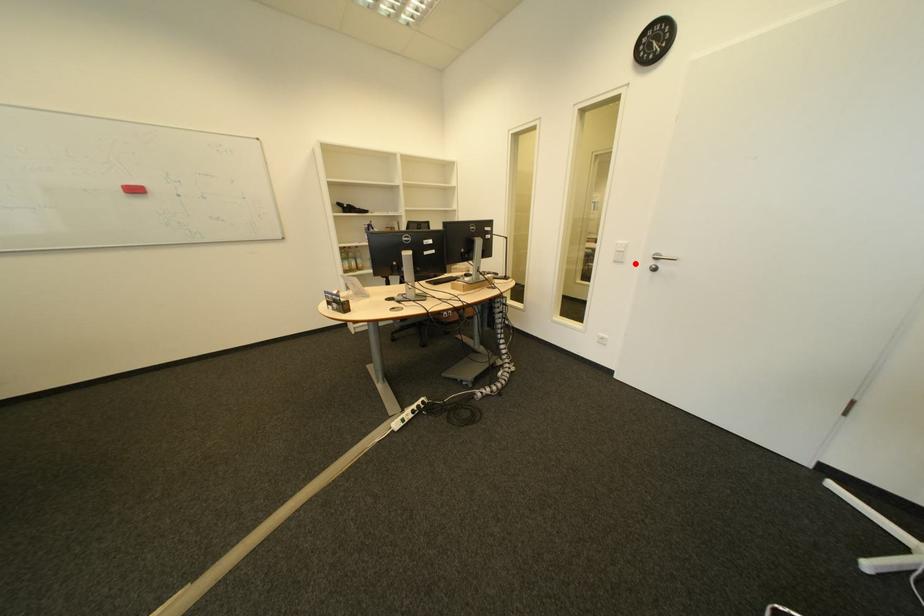
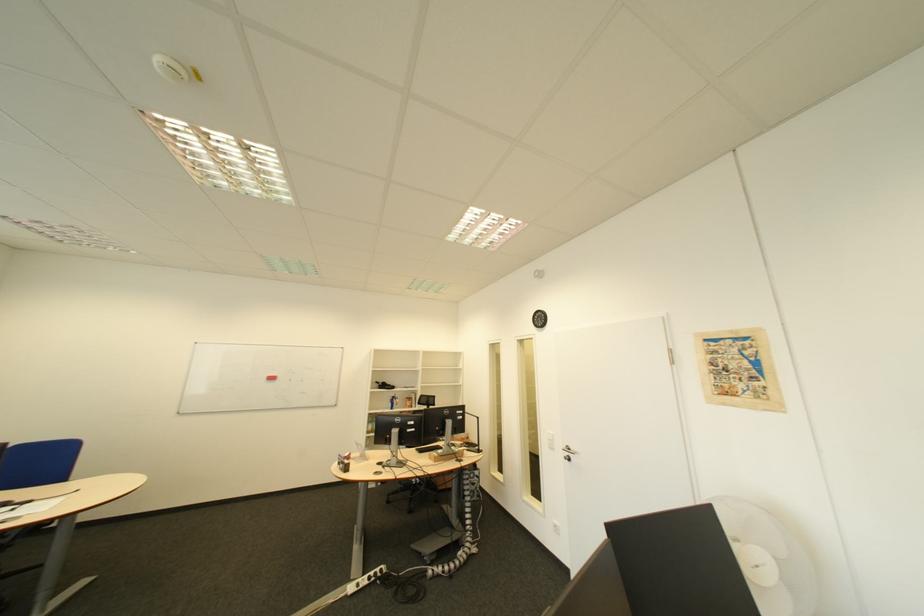
Locate, in the second image, the point that corresponds to the highlighted location in the first image.

(565, 451)